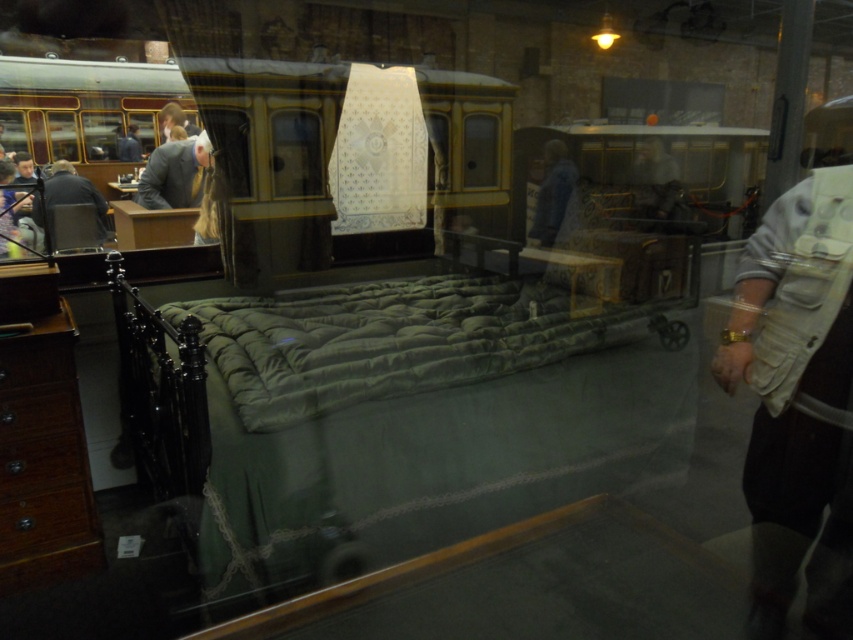
You are a visitor standing in front of the museum exhibit. You see the green fabric bed at center and the dark gray fabric jacket at left. Which object is positioned lower in the scene?

The green fabric bed at center is positioned lower than the dark gray fabric jacket at left, as it is located below it in the scene.

You are a museum visitor who wants to compare the jackets displayed in the exhibit. Which jacket is narrower between the blue denim jacket at center and the dark gray fabric jacket at left?

The blue denim jacket at center is narrower than the dark gray fabric jacket at left.